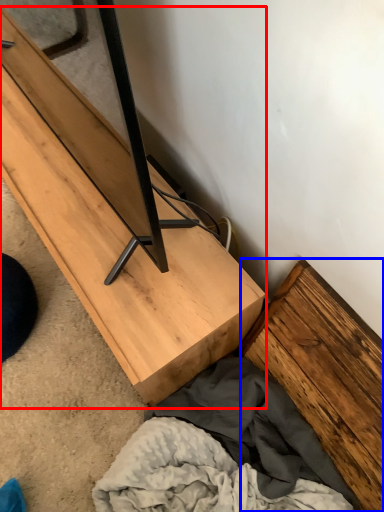
Question: Among these objects, which one is nearest to the camera, furniture (highlighted by a red box) or plank (highlighted by a blue box)?

Choices:
 (A) furniture
 (B) plank

Answer: (B)